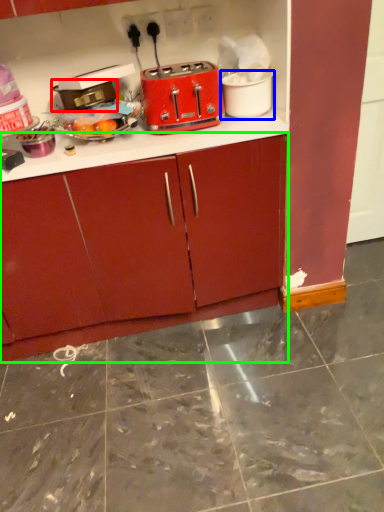
Question: Which object is the closest to the appliance (highlighted by a red box)? Choose among these: appliance (highlighted by a blue box) or cabinetry (highlighted by a green box).

Choices:
 (A) appliance
 (B) cabinetry

Answer: (A)